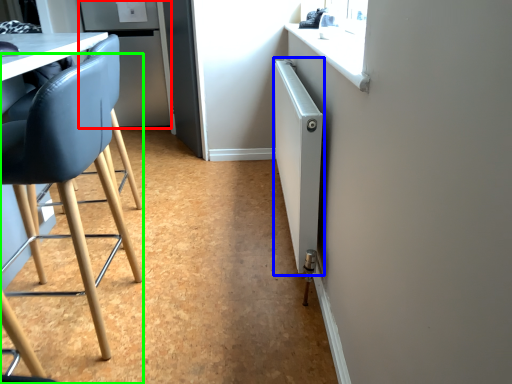
Question: Which object is positioned farthest from fridge (highlighted by a red box)? Select from radiator (highlighted by a blue box) and chair (highlighted by a green box).

Choices:
 (A) radiator
 (B) chair

Answer: (B)